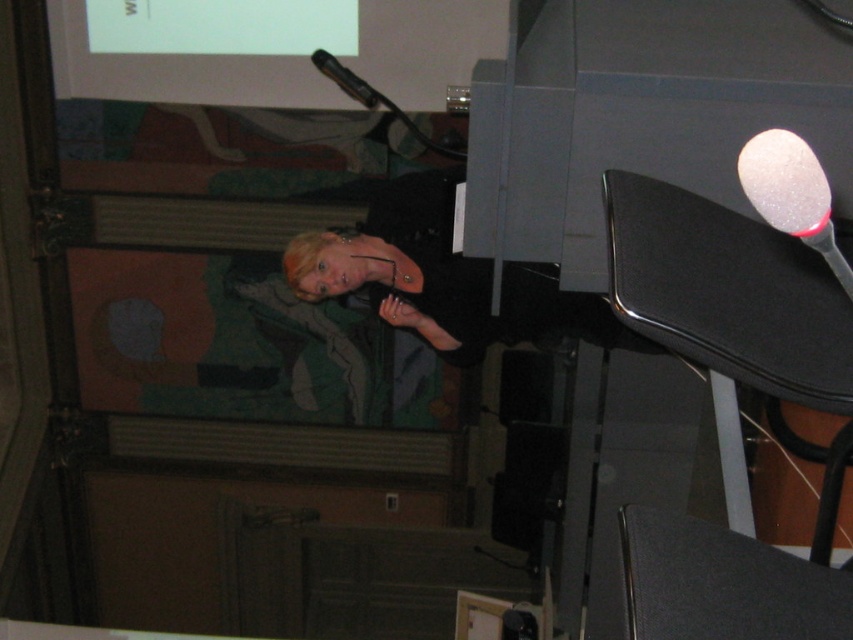
You are an event coordinator setting up for a presentation. You need to place a decorative sparkly white spoon at upper right and a functional black plastic microphone at upper center on a table. Based on the image, which object should be placed closer to the front of the table to match the scene?

The sparkly white spoon at upper right should be placed closer to the front of the table because it is closer to the viewer than the black plastic microphone at upper center in the image.

You are standing in the room and want to determine which of the two points, point (776, 186) or point (317, 60), is nearer to you. Which one would you say is closer?

Point (776, 186) is closer to the camera than point (317, 60), so it is the closer one.